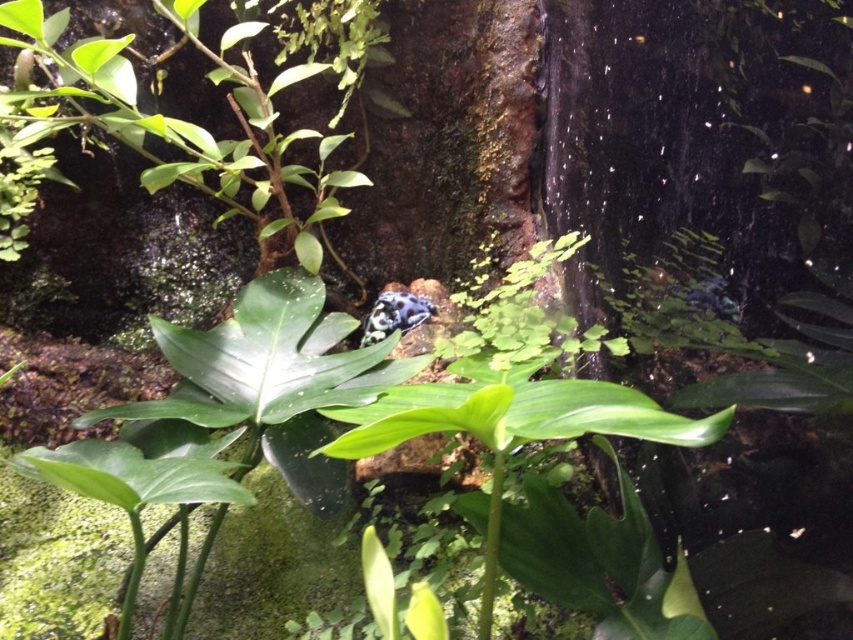
Can you confirm if green matte leaf at center-left is positioned above speckled blue frog at center?

Actually, green matte leaf at center-left is below speckled blue frog at center.

This screenshot has width=853, height=640. Identify the location of green matte leaf at center-left. (131, 474).

Where is `green matte leaf at center-left`? This screenshot has width=853, height=640. green matte leaf at center-left is located at coordinates (131, 474).

Between green matte leaf at center and speckled blue frog at center, which one is positioned lower?

green matte leaf at center is below.

Who is positioned more to the left, green matte leaf at center or speckled blue frog at center?

speckled blue frog at center is more to the left.

The width and height of the screenshot is (853, 640). What do you see at coordinates (425, 424) in the screenshot? I see `green matte leaf at center` at bounding box center [425, 424].

The width and height of the screenshot is (853, 640). Identify the location of green matte leaf at center. (425, 424).

Between point (76, 451) and point (465, 429), which one is positioned behind?

Positioned behind is point (76, 451).

Measure the distance from green matte leaf at center-left to green matte leaf at center.

green matte leaf at center-left is 31.45 centimeters from green matte leaf at center.

The image size is (853, 640). I want to click on green matte leaf at center-left, so click(x=131, y=474).